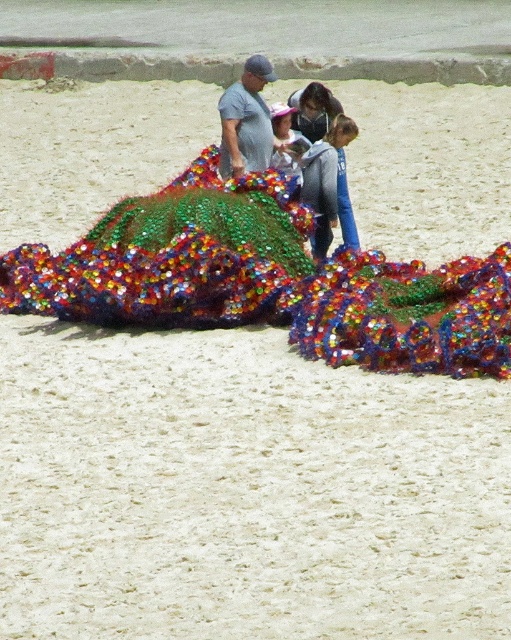
Question: Which is nearer to the shiny plastic blanket at center?

Choices:
 (A) matte plastic man at center
 (B) matte pink hat at center
 (C) shiny metallic blanket at center
 (D) matte gray hoodie at center

Answer: (C)

Question: Can you confirm if shiny plastic blanket at center is positioned to the left of matte blue shirt at upper center?

Choices:
 (A) yes
 (B) no

Answer: (A)

Question: Is shiny plastic blanket at center to the right of shiny metallic blanket at center from the viewer's perspective?

Choices:
 (A) no
 (B) yes

Answer: (B)

Question: Which object is farther from the camera taking this photo?

Choices:
 (A) shiny metallic blanket at center
 (B) matte plastic man at center

Answer: (B)

Question: In this image, where is matte plastic man at center located relative to matte gray hoodie at center?

Choices:
 (A) right
 (B) left

Answer: (B)

Question: Which point is closer to the camera?

Choices:
 (A) (316, 192)
 (B) (286, 276)
 (C) (226, 148)

Answer: (B)